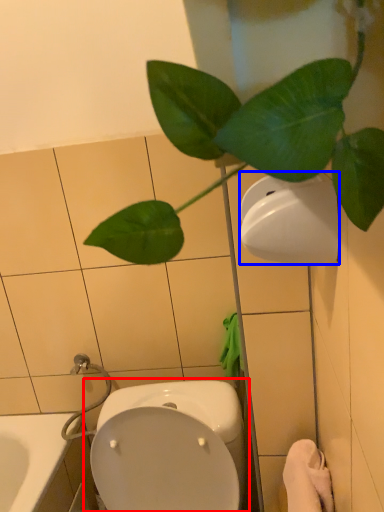
Question: Which object appears closest to the camera in this image, toilet (highlighted by a red box) or toilet paper (highlighted by a blue box)?

Choices:
 (A) toilet
 (B) toilet paper

Answer: (B)